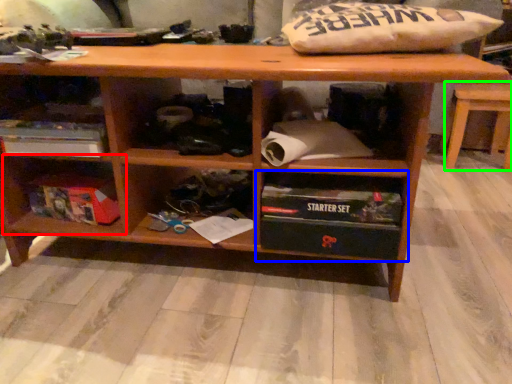
Question: Based on their relative distances, which object is nearer to shelf (highlighted by a red box)? Choose from shelf (highlighted by a blue box) and table (highlighted by a green box).

Choices:
 (A) shelf
 (B) table

Answer: (A)